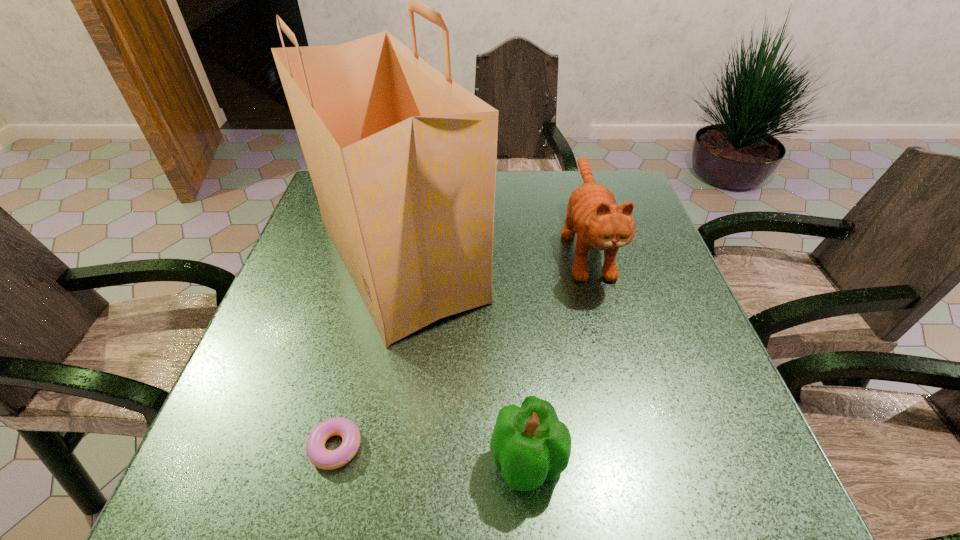
The width and height of the screenshot is (960, 540). I want to click on cat that is at the far edge, so click(592, 213).

Where is `bell pepper that is at the near edge`? The height and width of the screenshot is (540, 960). bell pepper that is at the near edge is located at coordinates [530, 444].

Where is `doughnut that is positioned at the near edge`? The width and height of the screenshot is (960, 540). doughnut that is positioned at the near edge is located at coordinates (319, 456).

The height and width of the screenshot is (540, 960). In order to click on object that is at the left edge in this screenshot , I will do `click(403, 159)`.

At what (x,y) coordinates should I click in order to perform the action: click on object present at the right edge. Please return your answer as a coordinate pair (x, y). The image size is (960, 540). Looking at the image, I should click on (592, 213).

Identify the location of object situated at the far left corner. (403, 159).

Identify the location of object that is at the far right corner. This screenshot has width=960, height=540. (592, 213).

This screenshot has height=540, width=960. What are the coordinates of `free point at the far edge` in the screenshot? It's located at (535, 171).

In order to click on free location at the near edge in this screenshot , I will do `click(491, 465)`.

Image resolution: width=960 pixels, height=540 pixels. In the image, there is a desktop. Find the location of `vacant region at the left edge`. vacant region at the left edge is located at coordinates (325, 313).